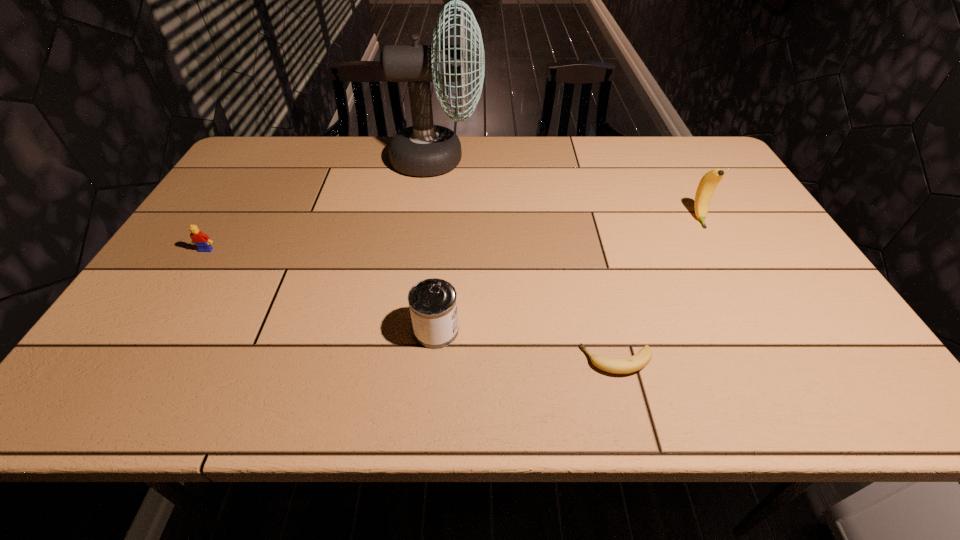
The width and height of the screenshot is (960, 540). What are the coordinates of `free space at the far edge of the desktop` in the screenshot? It's located at tap(478, 150).

Locate an element on the screen. This screenshot has height=540, width=960. free location at the left edge of the desktop is located at coordinates (170, 289).

In the image, there is a desktop. Identify the location of vacant space at the right edge. (755, 231).

Identify the location of free space at the far left corner. The width and height of the screenshot is (960, 540). [261, 145].

Where is `vacant space at the near right corner of the desktop`? vacant space at the near right corner of the desktop is located at coordinates (853, 381).

Identify the location of vacant space that's between the Lego and the farthest object. The width and height of the screenshot is (960, 540). point(322,205).

At what (x,y) coordinates should I click in order to perform the action: click on free spot between the shortest object and the third tallest object. Please return your answer as a coordinate pair (x, y). The image size is (960, 540). Looking at the image, I should click on (526, 346).

Find the location of `unoccupied area between the shorter banana and the can`. unoccupied area between the shorter banana and the can is located at coordinates (526, 346).

Find the location of a particular element. This screenshot has height=540, width=960. vacant space that is in between the tallest object and the shorter banana is located at coordinates (527, 260).

Identify the location of free space between the can and the Lego. (322, 291).